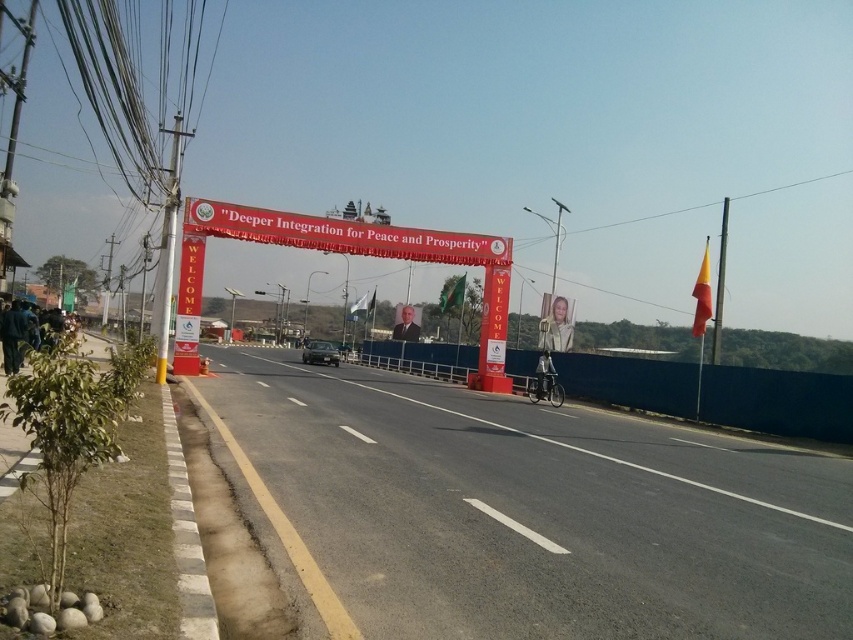
Looking at this image, what is the 2D coordinate of the red fabric banner at center?

The 2D coordinate of the red fabric banner at center is at point [344,253].

You are a pedestrian standing on the sidewalk on the left side of the road. You see a blue concrete barrier at center and a shiny black car at center. Which object is closer to you?

The blue concrete barrier at center is closer to you because it is positioned over the shiny black car at center, indicating it is in front of the car along your line of sight.